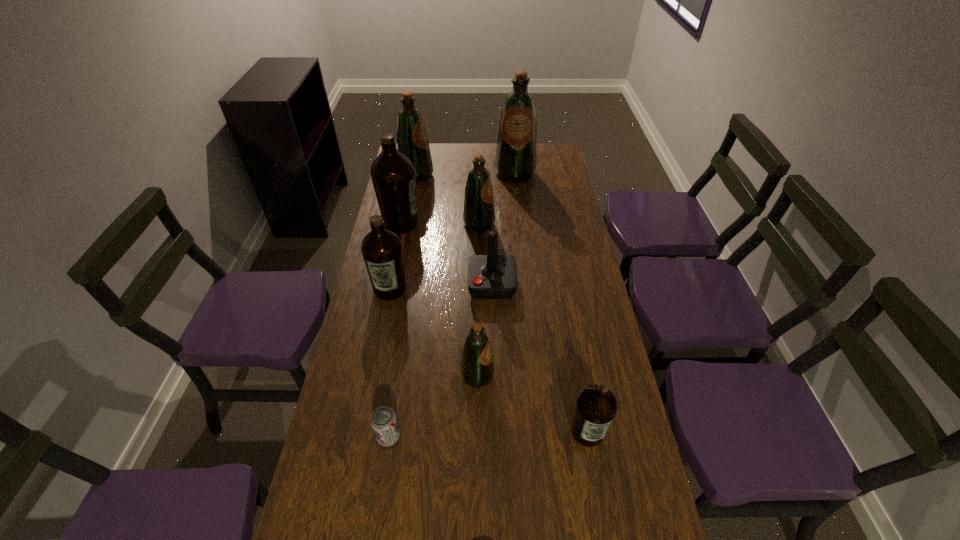
The width and height of the screenshot is (960, 540). I want to click on free spot located on the label of the smallest brown olive oil, so click(x=604, y=524).

The width and height of the screenshot is (960, 540). In order to click on free location located on the right of the shortest object in this screenshot , I will do `click(521, 437)`.

Where is `beer can present at the left edge`? beer can present at the left edge is located at coordinates pos(384,423).

Identify the location of object that is at the far left corner. (412, 140).

Identify the location of object that is at the far right corner. (515, 161).

At what (x,y) coordinates should I click in order to perform the action: click on free location at the far edge. Please return your answer as a coordinate pair (x, y). The width and height of the screenshot is (960, 540). Looking at the image, I should click on (472, 153).

In the image, there is a desktop. At what (x,y) coordinates should I click in order to perform the action: click on vacant space at the left edge. Please return your answer as a coordinate pair (x, y). The height and width of the screenshot is (540, 960). Looking at the image, I should click on (358, 467).

The height and width of the screenshot is (540, 960). What are the coordinates of `blank area at the right edge` in the screenshot? It's located at (583, 331).

The height and width of the screenshot is (540, 960). Identify the location of vacant space at the far right corner of the desktop. (548, 152).

The image size is (960, 540). What are the coordinates of `empty space that is in between the smallest brown olive oil and the third nearest object` in the screenshot? It's located at (533, 403).